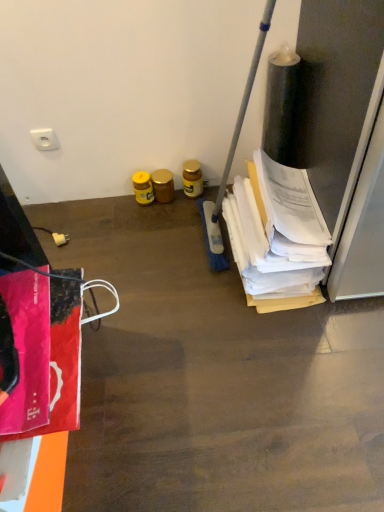
Question: Considering the relative positions of yellow matte jar at center, the first bottle viewed from the right, and yellow glossy jar at center, the third bottle viewed from the right, in the image provided, is yellow matte jar at center, the first bottle viewed from the right, in front of yellow glossy jar at center, the third bottle viewed from the right,?

Choices:
 (A) no
 (B) yes

Answer: (B)

Question: Can you confirm if yellow matte jar at center, the first bottle viewed from the right, is wider than yellow glossy jar at center, which ranks as the first bottle in left-to-right order?

Choices:
 (A) yes
 (B) no

Answer: (B)

Question: Is yellow matte jar at center, the 3th bottle viewed from the left, surrounding yellow glossy jar at center, the third bottle viewed from the right?

Choices:
 (A) yes
 (B) no

Answer: (B)

Question: Can you see yellow matte jar at center, the 3th bottle viewed from the left, touching yellow glossy jar at center, the third bottle viewed from the right?

Choices:
 (A) no
 (B) yes

Answer: (A)

Question: From a real-world perspective, is yellow matte jar at center, the 3th bottle viewed from the left, located beneath yellow glossy jar at center, which ranks as the first bottle in left-to-right order?

Choices:
 (A) yes
 (B) no

Answer: (B)

Question: Is yellow matte jar at center, the first bottle viewed from the right, thinner than yellow glossy jar at center, the third bottle viewed from the right?

Choices:
 (A) yes
 (B) no

Answer: (A)

Question: Considering the relative sizes of yellow glossy jar at center, which ranks as the first bottle in left-to-right order, and white plastic socket at upper left, placed as the 2th power plugs and sockets when sorted from bottom to top, in the image provided, is yellow glossy jar at center, which ranks as the first bottle in left-to-right order, thinner than white plastic socket at upper left, placed as the 2th power plugs and sockets when sorted from bottom to top,?

Choices:
 (A) no
 (B) yes

Answer: (A)

Question: Is yellow glossy jar at center, the third bottle viewed from the right, further to camera compared to white plastic socket at upper left, placed as the 2th power plugs and sockets when sorted from bottom to top?

Choices:
 (A) yes
 (B) no

Answer: (A)

Question: Is yellow glossy jar at center, the third bottle viewed from the right, not inside white plastic socket at upper left, placed as the 2th power plugs and sockets when sorted from bottom to top?

Choices:
 (A) yes
 (B) no

Answer: (A)

Question: Is yellow glossy jar at center, which ranks as the first bottle in left-to-right order, not near white plastic socket at upper left, which is the 1th power plugs and sockets from top to bottom?

Choices:
 (A) yes
 (B) no

Answer: (B)

Question: Can you confirm if yellow glossy jar at center, the third bottle viewed from the right, is wider than white plastic socket at upper left, which is the 1th power plugs and sockets from top to bottom?

Choices:
 (A) yes
 (B) no

Answer: (A)

Question: Can you confirm if yellow glossy jar at center, which ranks as the first bottle in left-to-right order, is shorter than white plastic socket at upper left, which is the 1th power plugs and sockets from top to bottom?

Choices:
 (A) no
 (B) yes

Answer: (A)

Question: Considering the relative positions of gold metallic jar at center, positioned as the 2th bottle in left-to-right order, and white plastic socket at upper left, which is the 1th power plugs and sockets from top to bottom, in the image provided, is gold metallic jar at center, positioned as the 2th bottle in left-to-right order, to the right of white plastic socket at upper left, which is the 1th power plugs and sockets from top to bottom, from the viewer's perspective?

Choices:
 (A) yes
 (B) no

Answer: (A)